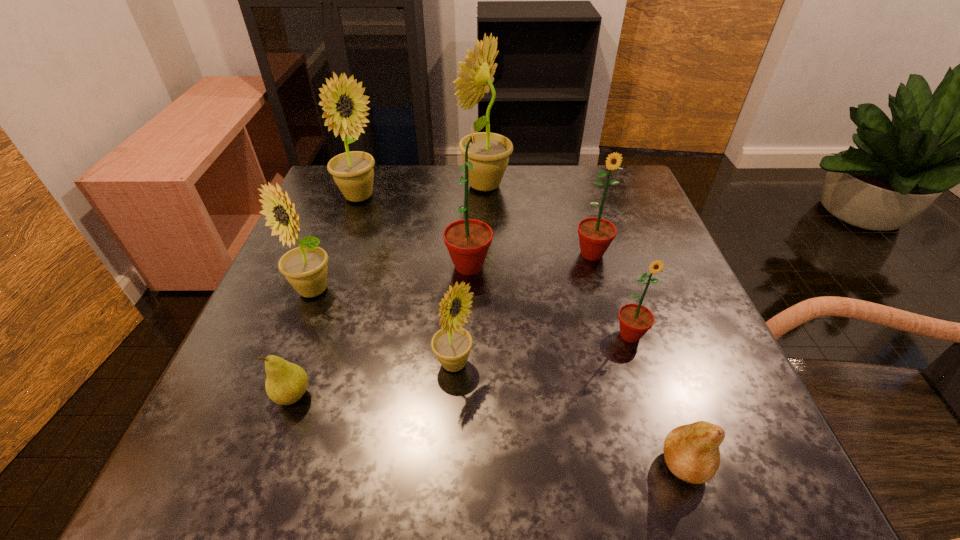
At what (x,y) coordinates should I click in order to perform the action: click on vacant space located 0.330m on the back of the farther pear. Please return your answer as a coordinate pair (x, y). Image resolution: width=960 pixels, height=540 pixels. Looking at the image, I should click on (345, 249).

Identify the location of vacant space situated 0.290m on the left of the nearer pear. Image resolution: width=960 pixels, height=540 pixels. (448, 465).

Identify the location of object that is at the near edge. The width and height of the screenshot is (960, 540). (691, 452).

You are a GUI agent. You are given a task and a screenshot of the screen. Output one action in this format:
    pyautogui.click(x=<x>, y=<y>)
    Task: Click on the pear present at the left edge
    
    Given the screenshot: What is the action you would take?
    pyautogui.click(x=286, y=383)

You are a GUI agent. You are given a task and a screenshot of the screen. Output one action in this format:
    pyautogui.click(x=<x>, y=<y>)
    Task: Click on the pear at the right edge
    
    Given the screenshot: What is the action you would take?
    pyautogui.click(x=691, y=452)

The image size is (960, 540). Find the location of `object that is at the far left corner`. object that is at the far left corner is located at coordinates (353, 173).

Where is `object present at the near right corner`? This screenshot has width=960, height=540. object present at the near right corner is located at coordinates (691, 452).

I want to click on vacant space at the far edge of the desktop, so click(x=533, y=171).

This screenshot has width=960, height=540. Identify the location of free space at the near edge of the desktop. (609, 475).

In the image, there is a desktop. Where is `free space at the left edge`? The image size is (960, 540). free space at the left edge is located at coordinates (289, 316).